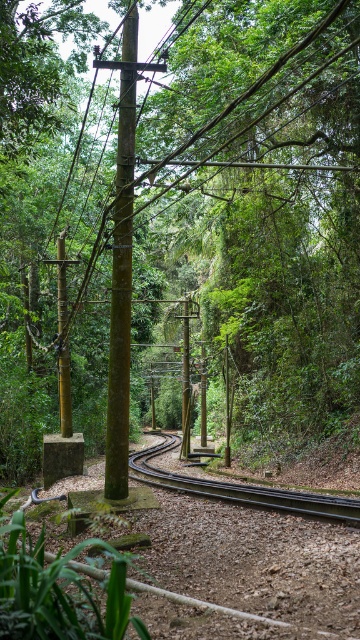
From the picture: You are a maintenance worker standing on the railway track. You need to inspect both the black metal train track at center and the green bamboo pole at center. Which object will you encounter first as you walk forward along the track?

The black metal train track at center is closer to the viewer than the green bamboo pole at center, so you will encounter the black metal train track at center first as you walk forward along the track.

You are a maintenance worker inspecting the railway. You notice the black metal train track at center and the green bamboo pole at center. Which object is bigger in size?

The black metal train track at center has a larger size compared to the green bamboo pole at center.